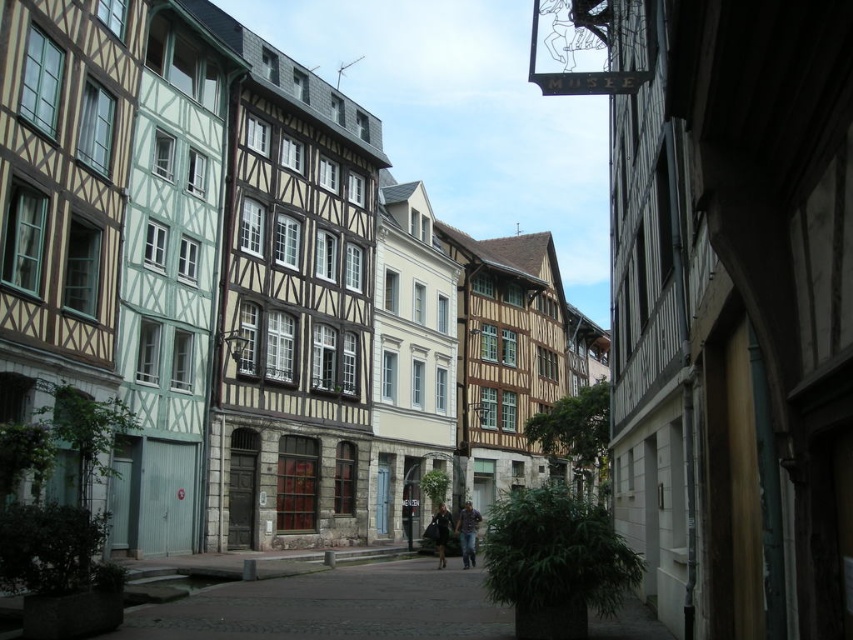
Question: Is denim jeans at center thinner than dark blue fabric coat at center?

Choices:
 (A) no
 (B) yes

Answer: (A)

Question: Is denim jeans at center above dark blue fabric coat at center?

Choices:
 (A) no
 (B) yes

Answer: (A)

Question: Is denim jeans at center below dark blue fabric coat at center?

Choices:
 (A) yes
 (B) no

Answer: (A)

Question: Which of the following is the farthest from the observer?

Choices:
 (A) (460, 516)
 (B) (439, 515)

Answer: (A)

Question: Among these points, which one is farthest from the camera?

Choices:
 (A) (440, 563)
 (B) (461, 518)

Answer: (B)